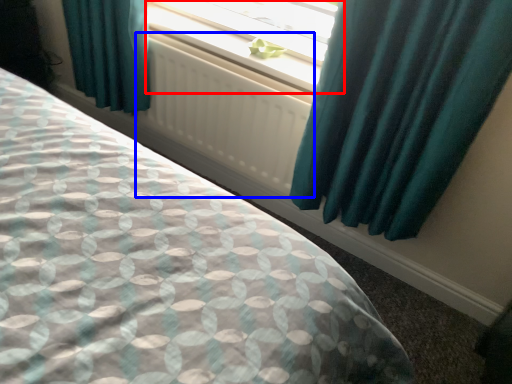
Question: Which object appears farthest to the camera in this image, window (highlighted by a red box) or radiator (highlighted by a blue box)?

Choices:
 (A) window
 (B) radiator

Answer: (A)